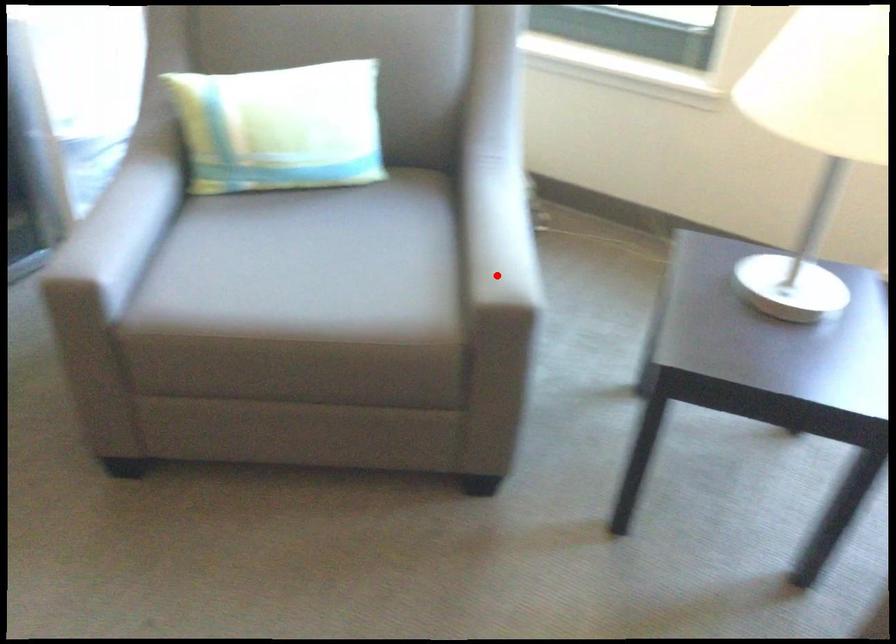
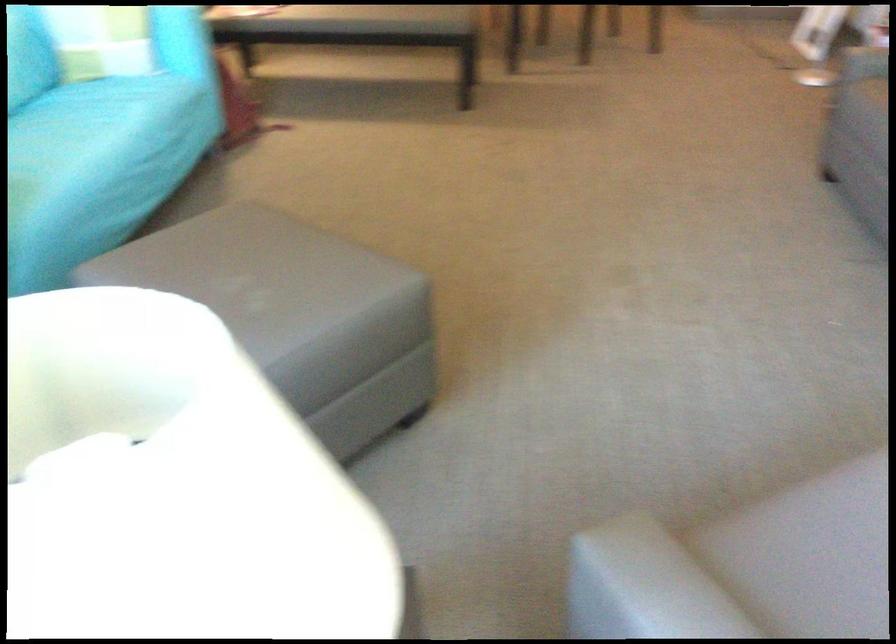
Question: I am providing you with two images of the same scene from different viewpoints. Image1 has a red point marked. In image2, the corresponding 3D location appears at what relative position? Reply with the corresponding letter.

Choices:
 (A) Closer
 (B) Farther

Answer: (A)